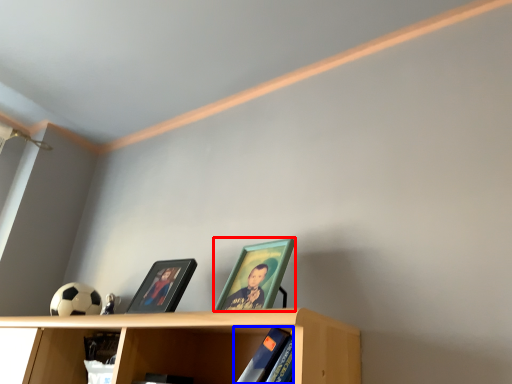
Question: Which of the following is the farthest to the observer, picture frame (highlighted by a red box) or book (highlighted by a blue box)?

Choices:
 (A) picture frame
 (B) book

Answer: (A)